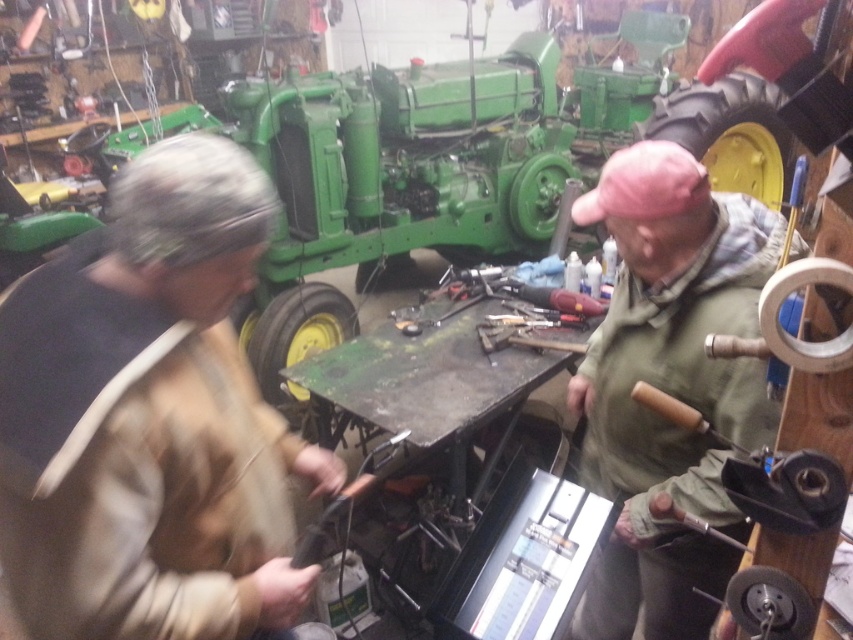
Who is positioned more to the left, camouflage fabric jacket at left or green fabric jacket at upper right?

From the viewer's perspective, camouflage fabric jacket at left appears more on the left side.

This screenshot has height=640, width=853. Describe the element at coordinates (163, 429) in the screenshot. I see `camouflage fabric jacket at left` at that location.

At what (x,y) coordinates should I click in order to perform the action: click on camouflage fabric jacket at left. Please return your answer as a coordinate pair (x, y). The height and width of the screenshot is (640, 853). Looking at the image, I should click on (163, 429).